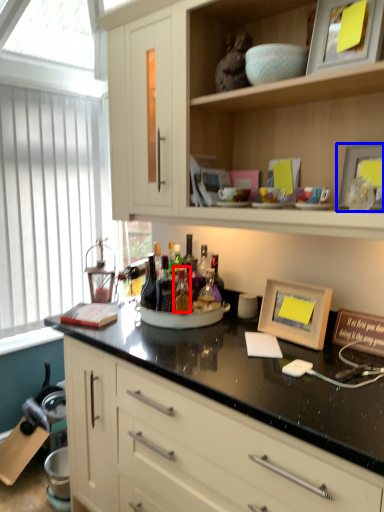
Question: Which point is further to the camera, bottle (highlighted by a red box) or picture frame (highlighted by a blue box)?

Choices:
 (A) bottle
 (B) picture frame

Answer: (A)